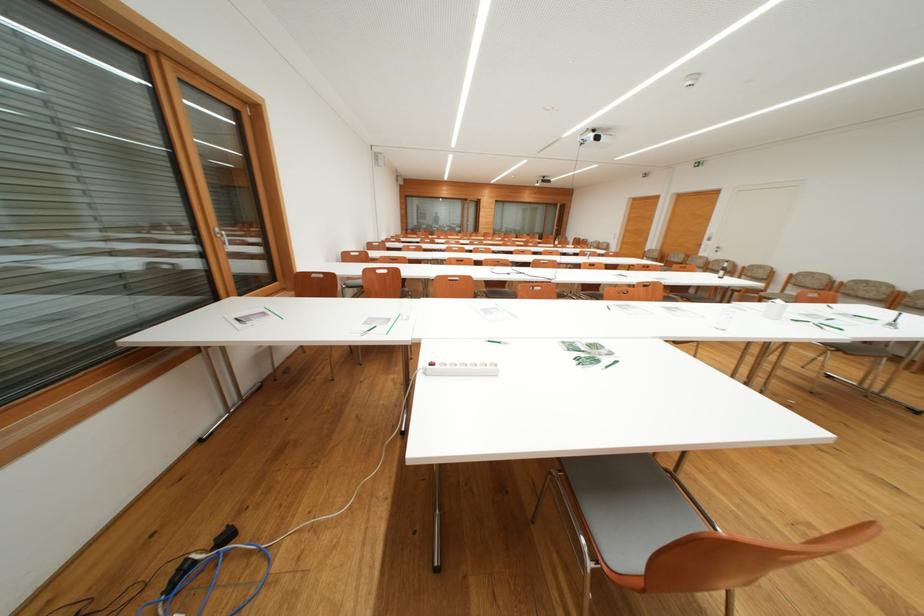
Find the location of `dark glass bottle`. dark glass bottle is located at coordinates (723, 270).